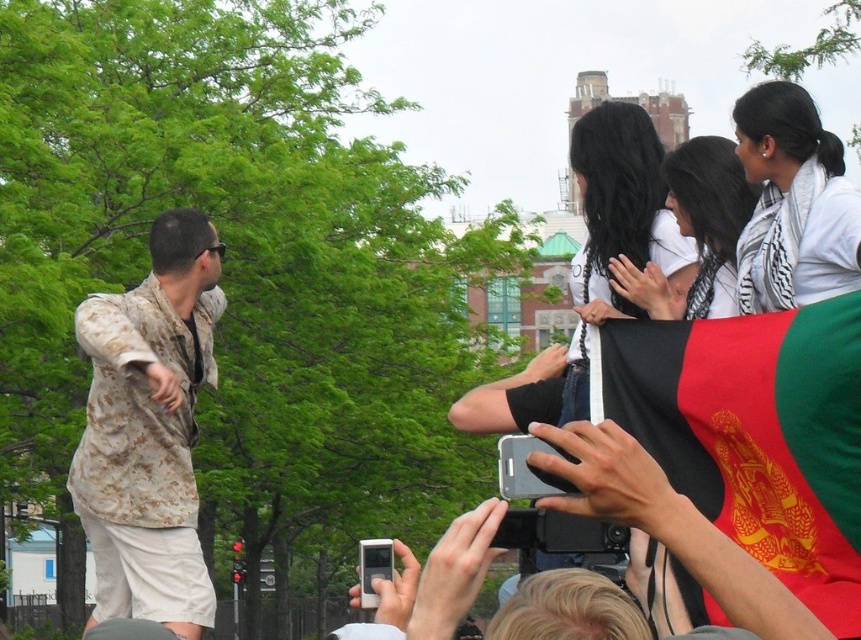
Does black fabric flag at upper right have a greater height compared to black silky hair at upper center?

Incorrect, black fabric flag at upper right's height is not larger of black silky hair at upper center's.

Does black fabric flag at upper right appear over black silky hair at upper center?

No.

Between point (855, 352) and point (552, 371), which one is positioned behind?

Point (552, 371)

Where is `black fabric flag at upper right`? The height and width of the screenshot is (640, 861). black fabric flag at upper right is located at coordinates (756, 435).

Find the location of a particular element. The width and height of the screenshot is (861, 640). black fabric flag at upper right is located at coordinates (756, 435).

Who is positioned more to the left, black fabric flag at upper right or camouflage fabric shirt at center?

camouflage fabric shirt at center is more to the left.

The height and width of the screenshot is (640, 861). Find the location of `black fabric flag at upper right`. black fabric flag at upper right is located at coordinates (756, 435).

Who is more forward, (614, 388) or (141, 518)?

Positioned in front is point (614, 388).

Can you confirm if black fabric flag at upper right is positioned above camouflage fabric shirt at left?

Actually, black fabric flag at upper right is below camouflage fabric shirt at left.

What do you see at coordinates (756, 435) in the screenshot? The width and height of the screenshot is (861, 640). I see `black fabric flag at upper right` at bounding box center [756, 435].

At what (x,y) coordinates should I click in order to perform the action: click on black fabric flag at upper right. Please return your answer as a coordinate pair (x, y). Image resolution: width=861 pixels, height=640 pixels. Looking at the image, I should click on (756, 435).